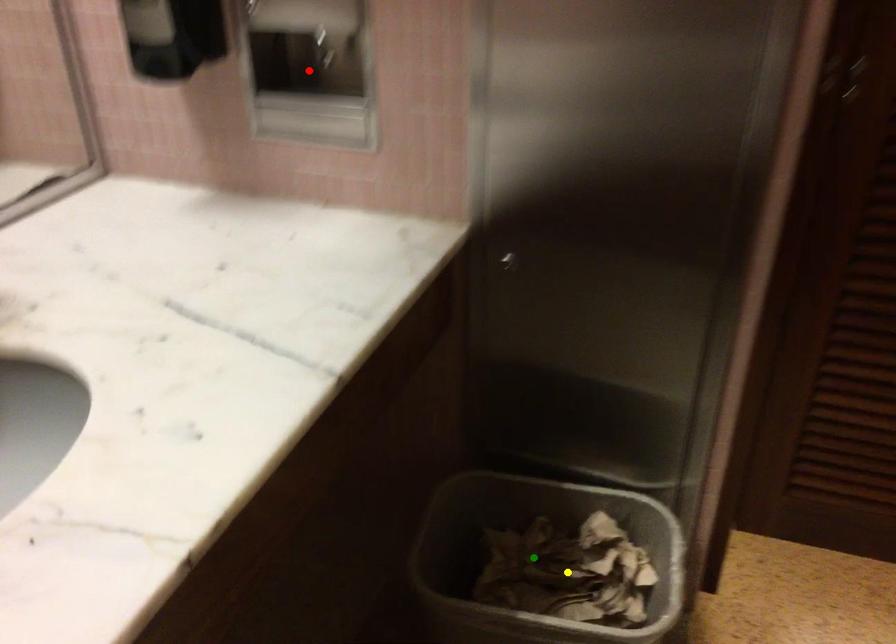
Order these from nearest to farthest:
A) red point
B) green point
C) yellow point

1. red point
2. yellow point
3. green point